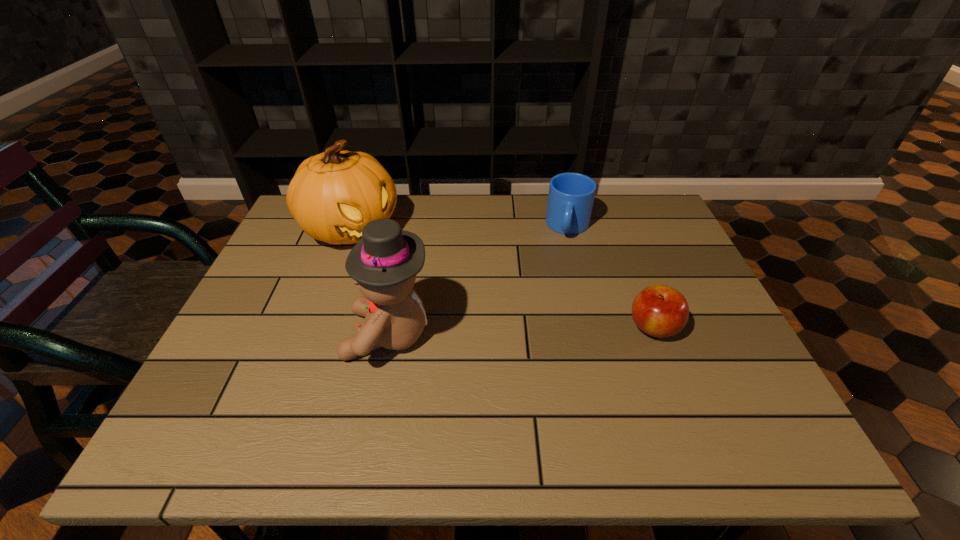
Where is `vacant space situated 0.340m on the stem of the rightmost object`? vacant space situated 0.340m on the stem of the rightmost object is located at coordinates (482, 328).

Find the location of a particular element. This screenshot has width=960, height=540. vacant area situated 0.150m on the stem of the rightmost object is located at coordinates (564, 328).

At what (x,y) coordinates should I click in order to perform the action: click on free region located on the side of the mug with the handle. Please return your answer as a coordinate pair (x, y). Image resolution: width=960 pixels, height=540 pixels. Looking at the image, I should click on (556, 336).

Image resolution: width=960 pixels, height=540 pixels. Identify the location of free point located 0.250m on the side of the mug with the handle. (560, 306).

Locate an element on the screen. free spot located on the side of the mug with the handle is located at coordinates (564, 269).

Where is `free region located on the front face of the pumpkin`? This screenshot has width=960, height=540. free region located on the front face of the pumpkin is located at coordinates (407, 266).

The width and height of the screenshot is (960, 540). What are the coordinates of `vacant space situated 0.300m on the front face of the pumpkin` in the screenshot? It's located at (457, 300).

Identify the location of free spot located 0.240m on the front face of the pumpkin. (441, 288).

Image resolution: width=960 pixels, height=540 pixels. Find the location of `mug that is positioned at the far edge`. mug that is positioned at the far edge is located at coordinates (571, 195).

You are a GUI agent. You are given a task and a screenshot of the screen. Output one action in this format:
    pyautogui.click(x=<x>, y=<y>)
    Task: Click on the pumpkin located at the far edge
    Image resolution: width=960 pixels, height=540 pixels.
    Given the screenshot: What is the action you would take?
    pyautogui.click(x=333, y=195)